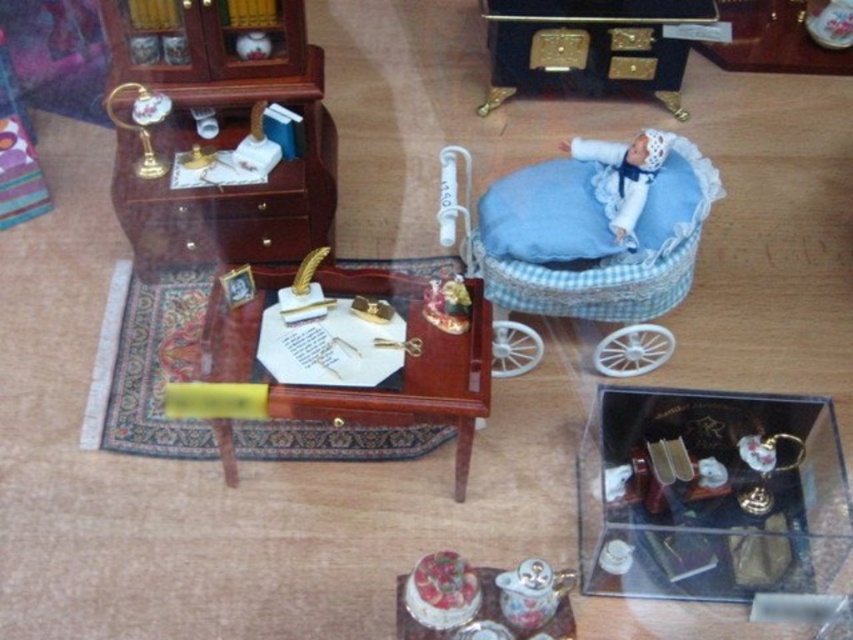
Question: Which object is positioned farthest from the blue checkered fabric baby carriage at upper right?

Choices:
 (A) porcelain teacup at lower center
 (B) white fabric doll at upper right
 (C) smooth porcelain cake at center
 (D) clear plastic box at center

Answer: (C)

Question: Which point is farther to the camera?

Choices:
 (A) (660, 332)
 (B) (525, 611)

Answer: (A)

Question: Among these objects, which one is farthest from the camera?

Choices:
 (A) wooden desk at center
 (B) blue checkered fabric baby carriage at upper right
 (C) clear plastic box at center
 (D) smooth porcelain cake at center

Answer: (B)

Question: Is clear plastic box at center positioned behind white fabric doll at upper right?

Choices:
 (A) yes
 (B) no

Answer: (B)

Question: Can you confirm if blue checkered fabric baby carriage at upper right is smaller than white fabric doll at upper right?

Choices:
 (A) yes
 (B) no

Answer: (B)

Question: Can you confirm if clear plastic box at center is bigger than white fabric doll at upper right?

Choices:
 (A) no
 (B) yes

Answer: (B)